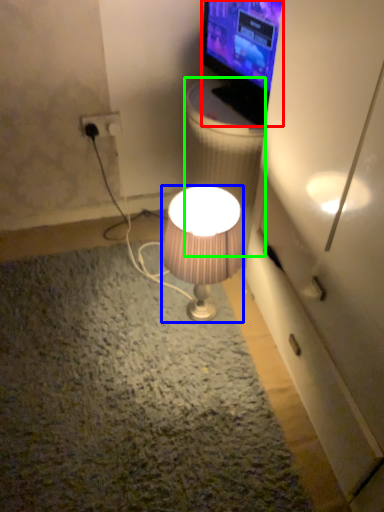
Question: Based on their relative distances, which object is nearer to television (highlighted by a red box)? Choose from lamp (highlighted by a blue box) and trash bin/can (highlighted by a green box).

Choices:
 (A) lamp
 (B) trash bin/can

Answer: (B)